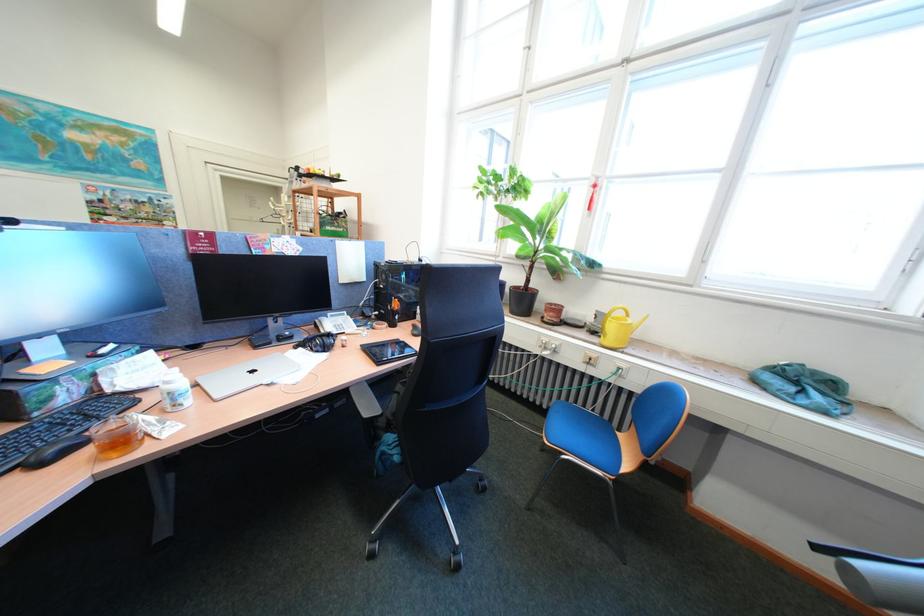
Find where to push the black chair armrest. Please return your answer as a coordinate pair (x, y).

(365, 400)